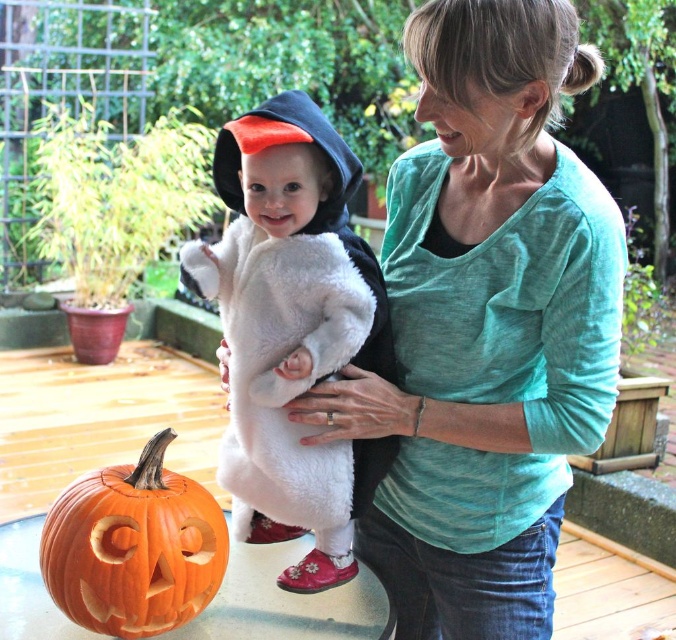
Measure the distance between teal soft shirt at center and orange carved pumpkin at lower left.

They are 16.40 inches apart.

The height and width of the screenshot is (640, 676). What do you see at coordinates (485, 324) in the screenshot?
I see `teal soft shirt at center` at bounding box center [485, 324].

Is point (579, 252) positioned behind point (170, 538)?

No, it is in front of (170, 538).

Where is `teal soft shirt at center`? Image resolution: width=676 pixels, height=640 pixels. teal soft shirt at center is located at coordinates (485, 324).

Does teal soft shirt at center have a greater width compared to fluffy white costume at center?

Yes.

Is teal soft shirt at center to the right of fluffy white costume at center from the viewer's perspective?

Indeed, teal soft shirt at center is positioned on the right side of fluffy white costume at center.

In order to click on teal soft shirt at center in this screenshot , I will do `click(485, 324)`.

Can you confirm if fluffy white costume at center is positioned to the right of orange carved pumpkin at lower left?

Correct, you'll find fluffy white costume at center to the right of orange carved pumpkin at lower left.

Can you confirm if fluffy white costume at center is bigger than orange carved pumpkin at lower left?

Indeed, fluffy white costume at center has a larger size compared to orange carved pumpkin at lower left.

Does point (364, 259) lie in front of point (116, 634)?

No, it is not.

Identify the location of fluffy white costume at center. (291, 330).